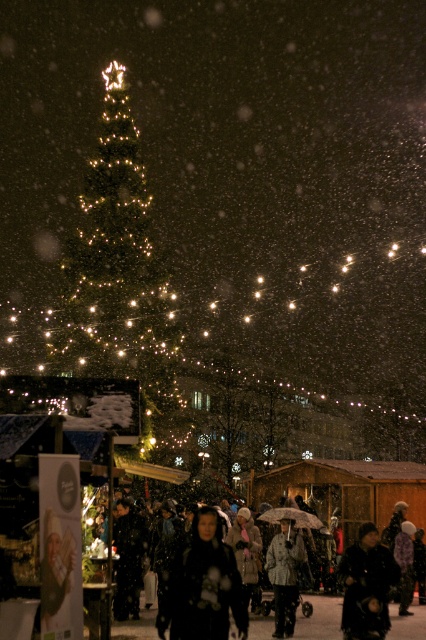
Question: Which point is closer to the camera?

Choices:
 (A) (126, 620)
 (B) (218, 595)
 (C) (121, 520)
 (D) (383, 572)

Answer: (B)

Question: Does black matte coat at center appear under dark gray fabric coat at center?

Choices:
 (A) yes
 (B) no

Answer: (A)

Question: Which object is closer to the camera taking this photo?

Choices:
 (A) dark gray fabric coat at center
 (B) dark matte coat at center

Answer: (B)

Question: Where is dark matte coat at center located in relation to gray textured coat at center in the image?

Choices:
 (A) above
 (B) below

Answer: (A)

Question: Can you confirm if black matte coat at center is positioned to the left of dark gray fabric coat at center?

Choices:
 (A) yes
 (B) no

Answer: (B)

Question: Which point is closer to the camera?

Choices:
 (A) dark gray fabric coat at center
 (B) black matte coat at center

Answer: (B)